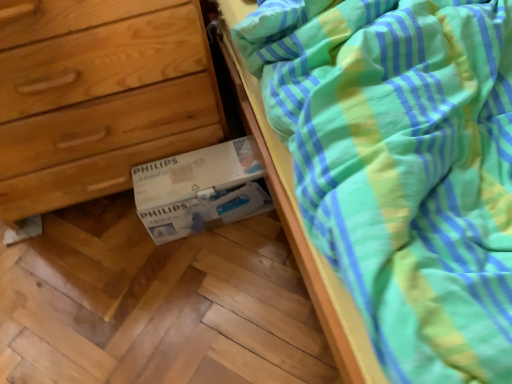
Where is `free space in front of white cardboard box at lower center`? free space in front of white cardboard box at lower center is located at coordinates (213, 283).